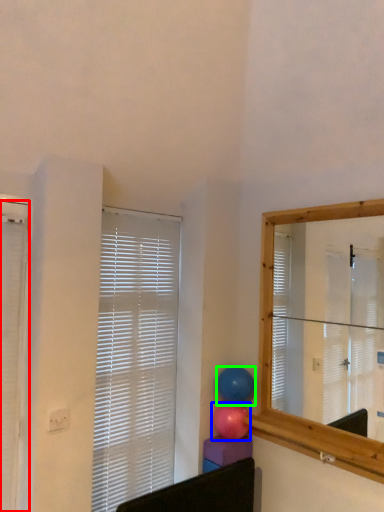
Question: Which is farther away from window blind (highlighted by a red box)? balloon (highlighted by a blue box) or balloon (highlighted by a green box)?

Choices:
 (A) balloon
 (B) balloon

Answer: (B)